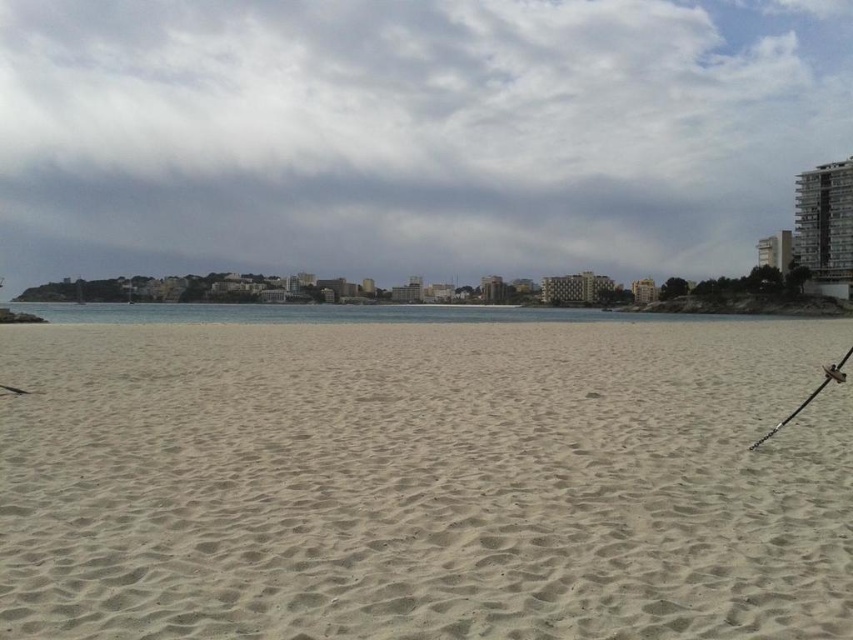
Question: Among these points, which one is farthest from the camera?

Choices:
 (A) (846, 349)
 (B) (831, 182)

Answer: (B)

Question: Among these points, which one is nearest to the camera?

Choices:
 (A) (213, 321)
 (B) (834, 172)
 (C) (755, 444)

Answer: (C)

Question: Can you confirm if light beige sand at center is positioned to the right of gray concrete building at upper right?

Choices:
 (A) yes
 (B) no

Answer: (B)

Question: Where is light beige sand at center located in relation to metallic fishing pole at lower right in the image?

Choices:
 (A) above
 (B) below

Answer: (A)

Question: Estimate the real-world distances between objects in this image. Which object is farther from the gray concrete building at upper right?

Choices:
 (A) light beige sand at center
 (B) metallic fishing pole at lower right
 (C) clear water at center

Answer: (B)

Question: Is gray concrete building at upper right bigger than metallic fishing pole at lower right?

Choices:
 (A) no
 (B) yes

Answer: (B)